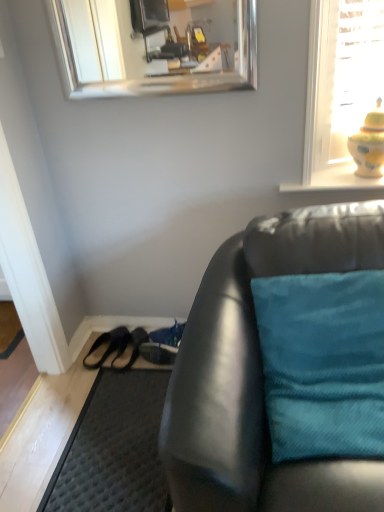
Question: From a real-world perspective, is silver/metallic mirror at upper center on top of black leather shoe at lower left, the 3th shoe from the right?

Choices:
 (A) no
 (B) yes

Answer: (B)

Question: Can you confirm if silver/metallic mirror at upper center is wider than black leather shoe at lower left, the 3th shoe from the right?

Choices:
 (A) yes
 (B) no

Answer: (B)

Question: Is silver/metallic mirror at upper center with black leather shoe at lower left, which appears as the first shoe when viewed from the left?

Choices:
 (A) no
 (B) yes

Answer: (A)

Question: Can we say silver/metallic mirror at upper center lies outside black leather shoe at lower left, which appears as the first shoe when viewed from the left?

Choices:
 (A) yes
 (B) no

Answer: (A)

Question: Can you confirm if silver/metallic mirror at upper center is taller than black leather shoe at lower left, which appears as the first shoe when viewed from the left?

Choices:
 (A) yes
 (B) no

Answer: (A)

Question: Could black leather shoe at lower left, the 3th shoe from the right, be considered to be inside silver/metallic mirror at upper center?

Choices:
 (A) no
 (B) yes

Answer: (A)

Question: Is the depth of teal fabric pillow at right less than that of yellow glazed vase at upper right?

Choices:
 (A) no
 (B) yes

Answer: (B)

Question: Is teal fabric pillow at right shorter than yellow glazed vase at upper right?

Choices:
 (A) no
 (B) yes

Answer: (A)

Question: From the image's perspective, is teal fabric pillow at right located beneath yellow glazed vase at upper right?

Choices:
 (A) yes
 (B) no

Answer: (A)

Question: Considering the relative sizes of teal fabric pillow at right and yellow glazed vase at upper right in the image provided, is teal fabric pillow at right taller than yellow glazed vase at upper right?

Choices:
 (A) no
 (B) yes

Answer: (B)

Question: From a real-world perspective, is teal fabric pillow at right below yellow glazed vase at upper right?

Choices:
 (A) no
 (B) yes

Answer: (B)

Question: Is the depth of teal fabric pillow at right greater than that of yellow glazed vase at upper right?

Choices:
 (A) no
 (B) yes

Answer: (A)

Question: From a real-world perspective, is teal fabric pillow at right physically above matte black couch at lower right?

Choices:
 (A) yes
 (B) no

Answer: (A)